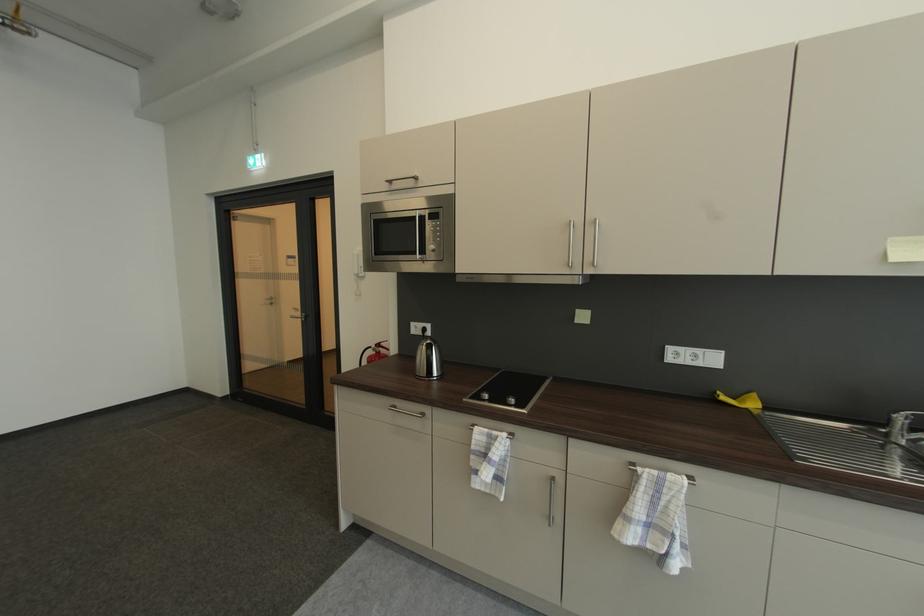
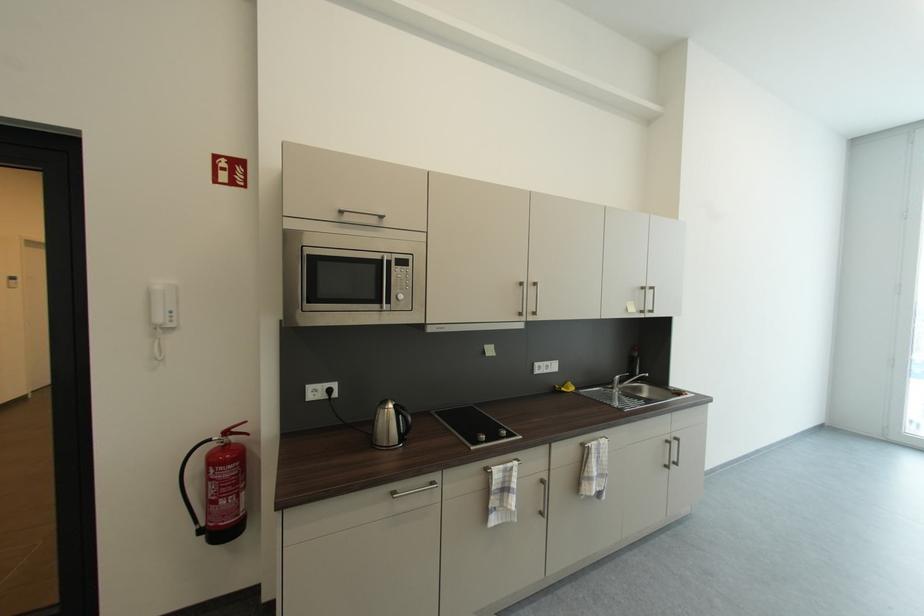
The point at (x=368, y=272) is marked in the first image. Where is the corresponding point in the second image?

(177, 318)